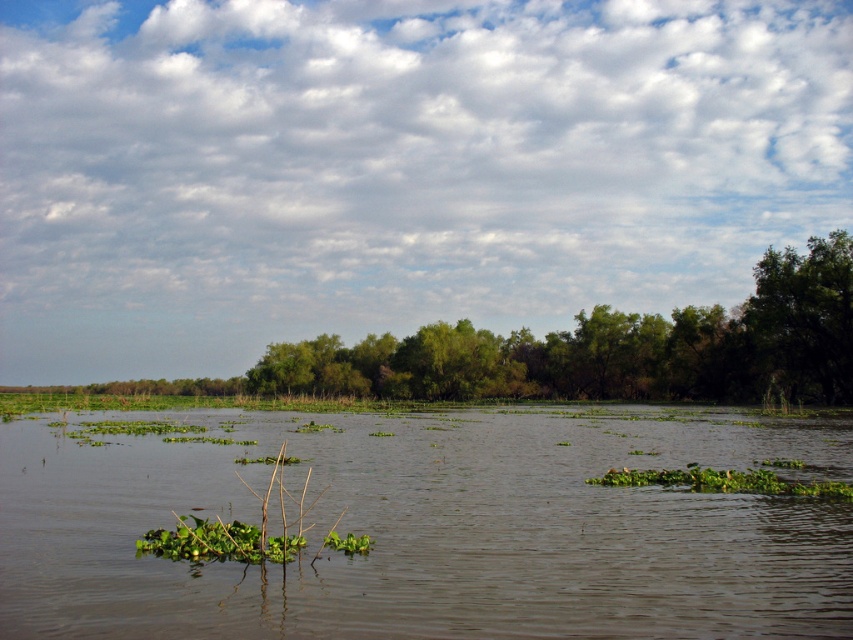
Question: Can you confirm if green leafy tree at right is thinner than green leafy plant at center?

Choices:
 (A) yes
 (B) no

Answer: (B)

Question: Is green leafy vegetation at center wider than green leafy tree at right?

Choices:
 (A) no
 (B) yes

Answer: (B)

Question: Is green leafy vegetation at center to the right of green leafy tree at right from the viewer's perspective?

Choices:
 (A) yes
 (B) no

Answer: (B)

Question: Estimate the real-world distances between objects in this image. Which object is farther from the green leafy plant at center?

Choices:
 (A) green leafy vegetation at center
 (B) green leafy tree at right

Answer: (B)

Question: Based on their relative distances, which object is nearer to the green leafy tree at right?

Choices:
 (A) green leafy vegetation at center
 (B) green leafy plant at center

Answer: (A)

Question: Which of these objects is positioned farthest from the green leafy plant at center?

Choices:
 (A) green leafy tree at right
 (B) green leafy vegetation at center

Answer: (A)